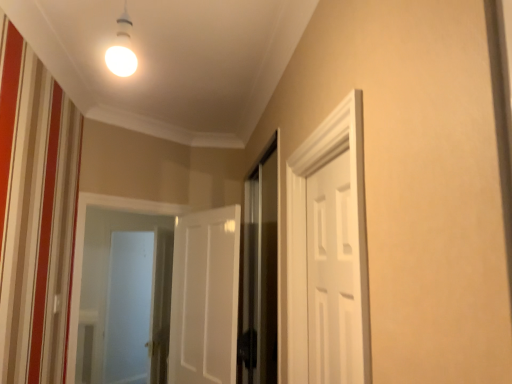
Find the location of a particular element. The width and height of the screenshot is (512, 384). transparent glass screen door at center, the 1th screen door viewed from the right is located at coordinates (260, 271).

Measure the distance between point (109, 293) and camera.

Point (109, 293) and camera are 4.69 meters apart from each other.

This screenshot has height=384, width=512. In order to click on white matte door at right, positioned as the 2th door in left-to-right order in this screenshot , I will do `click(335, 275)`.

How many degrees apart are the facing directions of frosted glass screen door at left, the 2th screen door viewed from the right, and white matte door at center, positioned as the first door in left-to-right order?

105 degrees.

Based on the photo, which is behind, frosted glass screen door at left, the first screen door viewed from the left, or white matte door at center, positioned as the first door in left-to-right order?

frosted glass screen door at left, the first screen door viewed from the left, is behind.

From the image's perspective, which one is positioned higher, frosted glass screen door at left, the first screen door viewed from the left, or white matte door at center, which is the first door in back-to-front order?

white matte door at center, which is the first door in back-to-front order, appears higher in the image.

Can you confirm if white matte door at right, acting as the first door starting from the front, is bigger than frosted glass screen door at left, the first screen door viewed from the left?

Incorrect, white matte door at right, acting as the first door starting from the front, is not larger than frosted glass screen door at left, the first screen door viewed from the left.

Does white matte door at right, positioned as the 2th door in left-to-right order, contain frosted glass screen door at left, acting as the first screen door starting from the back?

No, frosted glass screen door at left, acting as the first screen door starting from the back, is located outside of white matte door at right, positioned as the 2th door in left-to-right order.

Is white matte door at right, acting as the first door starting from the front, positioned with its back to frosted glass screen door at left, the 2th screen door viewed from the front?

No, frosted glass screen door at left, the 2th screen door viewed from the front, is not at the back of white matte door at right, acting as the first door starting from the front.

From a real-world perspective, starting from the white matte door at right, marked as the 1th door in a right-to-left arrangement, which screen door is the 2nd one below it? Please provide its 2D coordinates.

[(129, 308)]

Which of these two, white matte door at right, acting as the first door starting from the front, or transparent glass screen door at center, acting as the second screen door starting from the left, stands shorter?

With less height is white matte door at right, acting as the first door starting from the front.

In the image, is white matte door at right, positioned as the 2th door in left-to-right order, positioned in front of or behind transparent glass screen door at center, acting as the second screen door starting from the back?

white matte door at right, positioned as the 2th door in left-to-right order, is positioned closer to the viewer than transparent glass screen door at center, acting as the second screen door starting from the back.

Is point (346, 274) positioned behind point (271, 322)?

That is False.

Considering the positions of point (268, 281) and point (111, 290), is point (268, 281) closer or farther from the camera than point (111, 290)?

Point (268, 281).

From the image's perspective, which object appears higher, transparent glass screen door at center, acting as the second screen door starting from the back, or frosted glass screen door at left, acting as the first screen door starting from the back?

From the image's view, transparent glass screen door at center, acting as the second screen door starting from the back, is above.

Can you confirm if transparent glass screen door at center, acting as the second screen door starting from the left, is thinner than frosted glass screen door at left, acting as the first screen door starting from the back?

Yes, transparent glass screen door at center, acting as the second screen door starting from the left, is thinner than frosted glass screen door at left, acting as the first screen door starting from the back.

Is transparent glass screen door at center, acting as the second screen door starting from the left, to the left or to the right of frosted glass screen door at left, the first screen door viewed from the left, in the image?

Based on their positions, transparent glass screen door at center, acting as the second screen door starting from the left, is located to the right of frosted glass screen door at left, the first screen door viewed from the left.

Considering the relative sizes of transparent glass screen door at center, which ranks as the 1th screen door in front-to-back order, and white matte door at right, which ranks as the 2th door in back-to-front order, in the image provided, is transparent glass screen door at center, which ranks as the 1th screen door in front-to-back order, thinner than white matte door at right, which ranks as the 2th door in back-to-front order,?

Indeed, transparent glass screen door at center, which ranks as the 1th screen door in front-to-back order, has a lesser width compared to white matte door at right, which ranks as the 2th door in back-to-front order.

Considering the relative positions of transparent glass screen door at center, which ranks as the 1th screen door in front-to-back order, and white matte door at right, marked as the 1th door in a right-to-left arrangement, in the image provided, is transparent glass screen door at center, which ranks as the 1th screen door in front-to-back order, behind white matte door at right, marked as the 1th door in a right-to-left arrangement,?

Yes, it is.

Is white matte door at right, acting as the first door starting from the front, placed right next to white matte door at center, which is the first door in back-to-front order?

No, white matte door at right, acting as the first door starting from the front, is not beside white matte door at center, which is the first door in back-to-front order.

Which is further, (346, 296) or (177, 230)?

The point (177, 230) is farther from the camera.

Which object is thinner, white matte door at right, which ranks as the 2th door in back-to-front order, or white matte door at center, which is the 2th door in front-to-back order?

white matte door at right, which ranks as the 2th door in back-to-front order.

How different are the orientations of transparent glass screen door at center, the 1th screen door viewed from the right, and white matte door at center, which is the 2th door in front-to-back order, in degrees?

The angle between the facing direction of transparent glass screen door at center, the 1th screen door viewed from the right, and the facing direction of white matte door at center, which is the 2th door in front-to-back order, is 33.8 degrees.

Does transparent glass screen door at center, acting as the second screen door starting from the back, appear on the right side of white matte door at center, positioned as the first door in left-to-right order?

Yes.

Is transparent glass screen door at center, the 1th screen door viewed from the right, not inside white matte door at center, which is the first door in back-to-front order?

Absolutely, transparent glass screen door at center, the 1th screen door viewed from the right, is external to white matte door at center, which is the first door in back-to-front order.

From a real-world perspective, who is located higher, transparent glass screen door at center, acting as the second screen door starting from the left, or white matte door at center, which is the 2th door in front-to-back order?

transparent glass screen door at center, acting as the second screen door starting from the left, is physically above.

The width and height of the screenshot is (512, 384). I want to click on screen door below the white matte door at center, which is the 2th door in front-to-back order (from the image's perspective), so pyautogui.click(x=129, y=308).

From the image's perspective, starting from the frosted glass screen door at left, the 2th screen door viewed from the front, which door is the 2nd one above? Please provide its 2D coordinates.

[(335, 275)]

Looking at the image, which one is located closer to white matte door at center, positioned as the first door in left-to-right order, transparent glass screen door at center, the 1th screen door viewed from the right, or white matte door at right, which ranks as the 2th door in back-to-front order?

Based on the image, transparent glass screen door at center, the 1th screen door viewed from the right, appears to be nearer to white matte door at center, positioned as the first door in left-to-right order.

Based on the photo, when comparing their distances from white matte door at right, marked as the 1th door in a right-to-left arrangement, does transparent glass screen door at center, acting as the second screen door starting from the back, or frosted glass screen door at left, the first screen door viewed from the left, seem further?

frosted glass screen door at left, the first screen door viewed from the left, is further to white matte door at right, marked as the 1th door in a right-to-left arrangement.

From the image, which object appears to be nearer to white matte door at center, which is the 2th door in front-to-back order, white matte door at right, positioned as the 2th door in left-to-right order, or frosted glass screen door at left, the 2th screen door viewed from the front?

Among the two, white matte door at right, positioned as the 2th door in left-to-right order, is located nearer to white matte door at center, which is the 2th door in front-to-back order.

Looking at this image, looking at the image, which one is located closer to frosted glass screen door at left, the first screen door viewed from the left, white matte door at right, marked as the 1th door in a right-to-left arrangement, or white matte door at center, which is the 2th door in front-to-back order?

white matte door at center, which is the 2th door in front-to-back order, is closer to frosted glass screen door at left, the first screen door viewed from the left.

Based on their spatial positions, is frosted glass screen door at left, acting as the first screen door starting from the back, or white matte door at center, which is the first door in back-to-front order, further from transparent glass screen door at center, the 1th screen door viewed from the right?

frosted glass screen door at left, acting as the first screen door starting from the back.

Estimate the real-world distances between objects in this image. Which object is closer to frosted glass screen door at left, acting as the first screen door starting from the back, white matte door at center, positioned as the first door in left-to-right order, or white matte door at right, positioned as the 2th door in left-to-right order?

white matte door at center, positioned as the first door in left-to-right order, is closer to frosted glass screen door at left, acting as the first screen door starting from the back.

Considering their positions, is white matte door at center, which is the first door in back-to-front order, positioned further to white matte door at right, which ranks as the 2th door in back-to-front order, than frosted glass screen door at left, the 2th screen door viewed from the right?

Based on the image, frosted glass screen door at left, the 2th screen door viewed from the right, appears to be further to white matte door at right, which ranks as the 2th door in back-to-front order.

When comparing their distances from white matte door at center, which is the first door in back-to-front order, does white matte door at right, which ranks as the 2th door in back-to-front order, or transparent glass screen door at center, acting as the second screen door starting from the back, seem closer?

Based on the image, transparent glass screen door at center, acting as the second screen door starting from the back, appears to be nearer to white matte door at center, which is the first door in back-to-front order.

At what (x,y) coordinates should I click in order to perform the action: click on door between white matte door at right, marked as the 1th door in a right-to-left arrangement, and frosted glass screen door at left, acting as the first screen door starting from the back, in the front-back direction. Please return your answer as a coordinate pair (x, y). Looking at the image, I should click on [x=205, y=297].

At what (x,y) coordinates should I click in order to perform the action: click on screen door between white matte door at right, acting as the first door starting from the front, and white matte door at center, positioned as the first door in left-to-right order, from front to back. Please return your answer as a coordinate pair (x, y). Image resolution: width=512 pixels, height=384 pixels. Looking at the image, I should click on (260, 271).

Where is `door located between transparent glass screen door at center, the 1th screen door viewed from the right, and frosted glass screen door at left, the 2th screen door viewed from the right, in the depth direction`? Image resolution: width=512 pixels, height=384 pixels. door located between transparent glass screen door at center, the 1th screen door viewed from the right, and frosted glass screen door at left, the 2th screen door viewed from the right, in the depth direction is located at coordinates (205, 297).

At what (x,y) coordinates should I click in order to perform the action: click on screen door located between white matte door at right, marked as the 1th door in a right-to-left arrangement, and frosted glass screen door at left, the 2th screen door viewed from the right, in the depth direction. Please return your answer as a coordinate pair (x, y). The image size is (512, 384). Looking at the image, I should click on (260, 271).